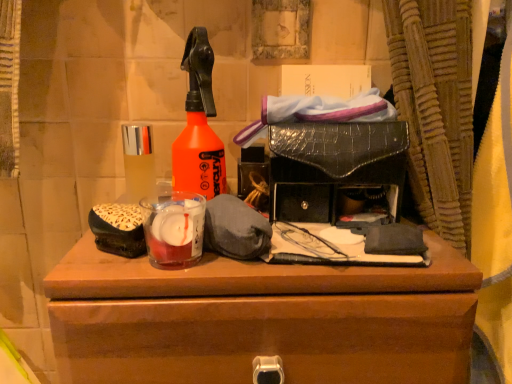
Question: From a real-world perspective, is translucent glass bottle at center left positioned over brown wooden chest of drawers at center based on gravity?

Choices:
 (A) yes
 (B) no

Answer: (A)

Question: Is translucent glass bottle at center left wider than brown wooden chest of drawers at center?

Choices:
 (A) no
 (B) yes

Answer: (A)

Question: Could you tell me if translucent glass bottle at center left is turned towards brown wooden chest of drawers at center?

Choices:
 (A) yes
 (B) no

Answer: (B)

Question: Does translucent glass bottle at center left lie in front of brown wooden chest of drawers at center?

Choices:
 (A) no
 (B) yes

Answer: (A)

Question: Is brown wooden chest of drawers at center a part of translucent glass bottle at center left?

Choices:
 (A) no
 (B) yes

Answer: (A)

Question: Is there a large distance between translucent glass bottle at center left and brown wooden chest of drawers at center?

Choices:
 (A) no
 (B) yes

Answer: (A)

Question: From the image's perspective, is translucent glass bottle at center left beneath translucent glass candle at center?

Choices:
 (A) no
 (B) yes

Answer: (A)

Question: Can you confirm if translucent glass bottle at center left is smaller than translucent glass candle at center?

Choices:
 (A) yes
 (B) no

Answer: (A)

Question: From the image's perspective, is translucent glass bottle at center left above translucent glass candle at center?

Choices:
 (A) no
 (B) yes

Answer: (B)

Question: Could you tell me if translucent glass bottle at center left is turned towards translucent glass candle at center?

Choices:
 (A) no
 (B) yes

Answer: (A)

Question: Would you say translucent glass bottle at center left is a long distance from translucent glass candle at center?

Choices:
 (A) yes
 (B) no

Answer: (B)

Question: Is translucent glass bottle at center left in front of translucent glass candle at center?

Choices:
 (A) no
 (B) yes

Answer: (A)

Question: Considering the relative positions of brown wooden chest of drawers at center and translucent glass bottle at center left in the image provided, is brown wooden chest of drawers at center to the left of translucent glass bottle at center left from the viewer's perspective?

Choices:
 (A) yes
 (B) no

Answer: (B)